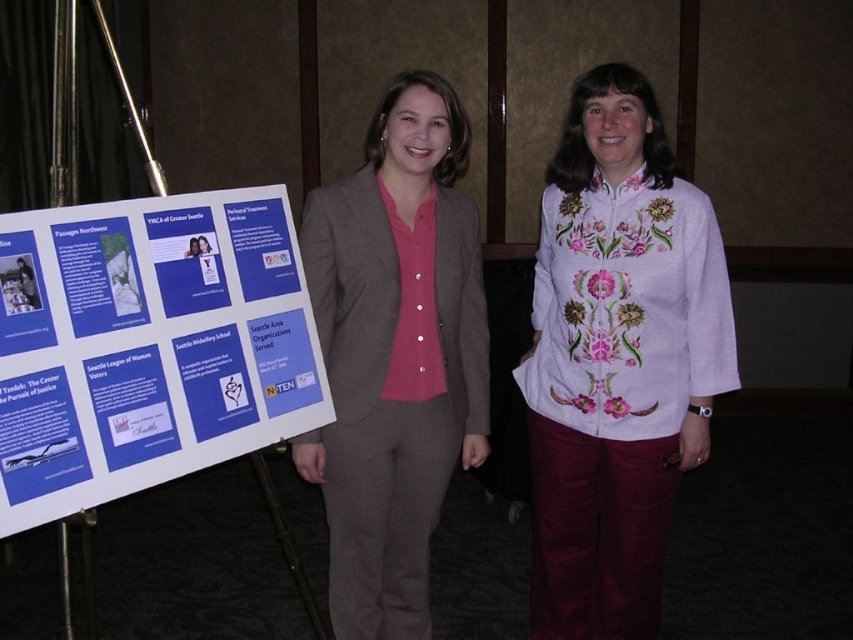
You are a photographer setting up for a group photo. You notice the white embroidered blouse at center and the matte gray suit at center. Which clothing item should you adjust to ensure both are visible in the frame?

The white embroidered blouse at center is located below the matte gray suit at center. To ensure both are visible in the frame, adjust the camera angle to capture the lower position of the white embroidered blouse at center and the higher position of the matte gray suit at center.

You are a photographer setting up for a group photo. You need to ensure that all clothing items are visible in the frame. Given that the white embroidered blouse at center and the matte gray suit at center are both at the center, which clothing item might require more space to fully capture in the photo?

The white embroidered blouse at center has a larger width than the matte gray suit at center, so it might require more space to fully capture in the photo.

You are an event planner trying to arrange a presentation in a room. You have a blue paper poster at left and a matte gray suit at center. Which object takes up more space in the room?

The matte gray suit at center takes up more space in the room than the blue paper poster at left because the blue paper poster at left has a smaller size compared to matte gray suit at center.